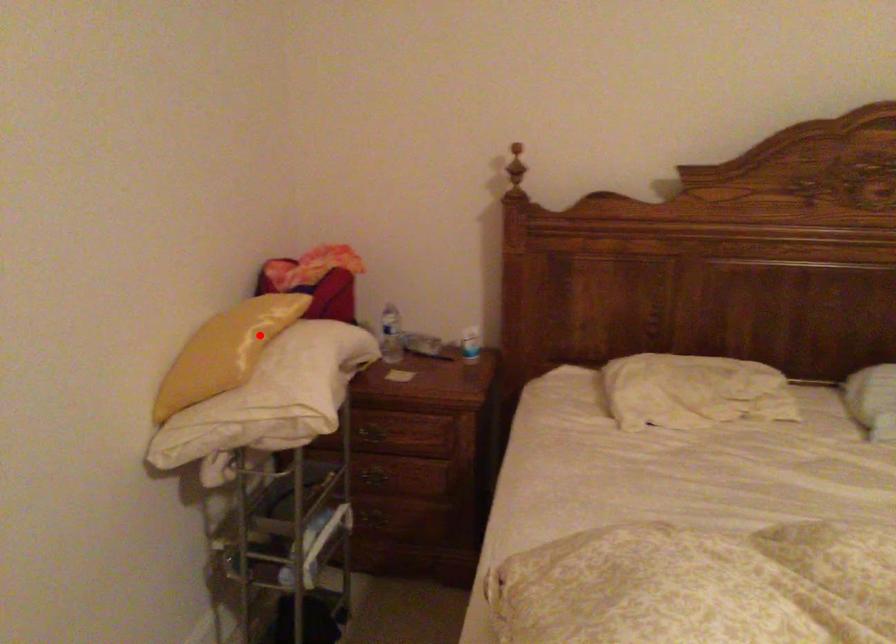
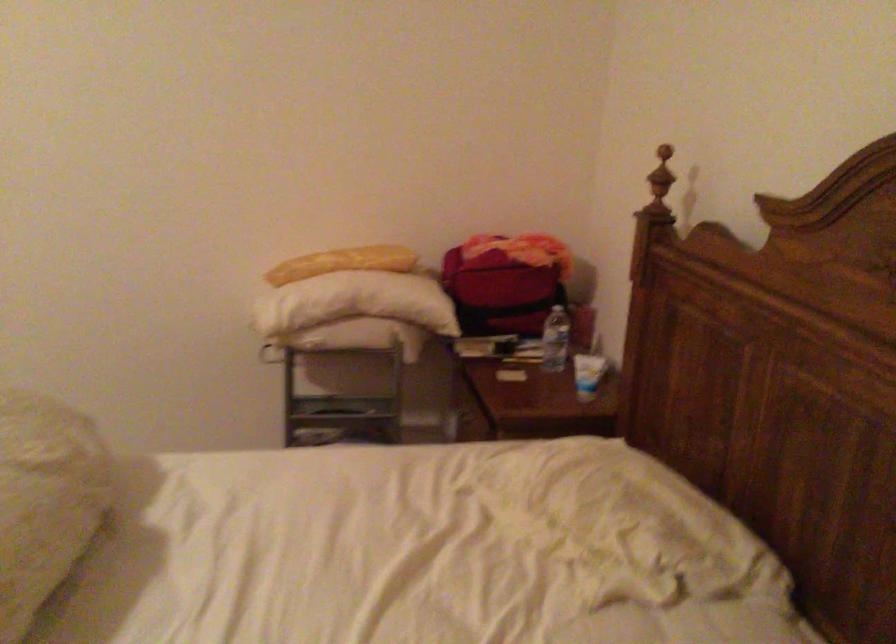
Question: I am providing you with two images of the same scene from different viewpoints. In image1, a red point is highlighted. Considering the same 3D point in image2, which of the following is correct?

Choices:
 (A) It is closer
 (B) It is farther

Answer: (B)